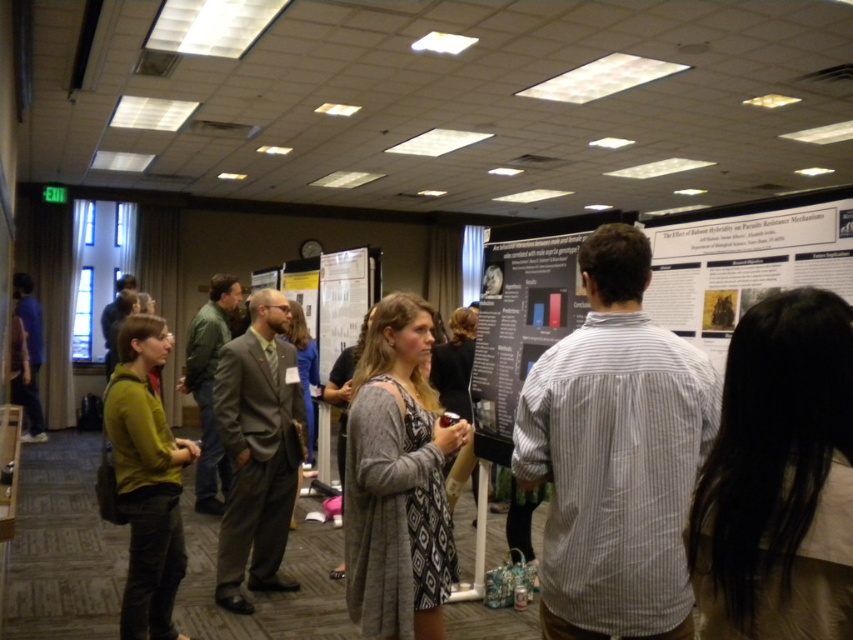
Question: Is the position of black hair at upper right more distant than that of gray textured dress at center?

Choices:
 (A) yes
 (B) no

Answer: (B)

Question: Is black hair at upper right below dark gray poster at center?

Choices:
 (A) no
 (B) yes

Answer: (B)

Question: Which object is positioned closest to the black hair at upper right?

Choices:
 (A) dark gray poster at center
 (B) white striped shirt at center

Answer: (B)

Question: Can you confirm if gray suit at center is bigger than white paper poster at center?

Choices:
 (A) no
 (B) yes

Answer: (A)

Question: Which object appears farthest from the camera in this image?

Choices:
 (A) black hair at upper right
 (B) gray suit at center
 (C) white striped shirt at center
 (D) gray textured dress at center

Answer: (B)

Question: Which point appears farthest from the camera in this image?

Choices:
 (A) (606, 420)
 (B) (828, 332)
 (C) (339, 289)

Answer: (C)